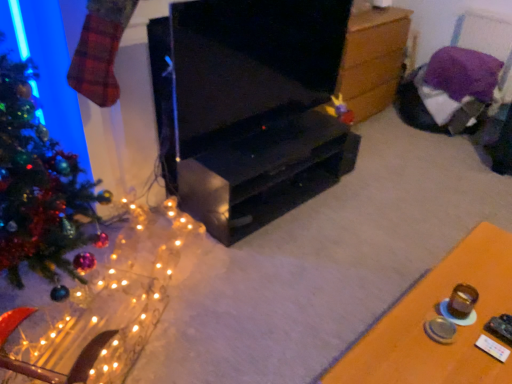
The height and width of the screenshot is (384, 512). I want to click on blank space above wooden table at lower right, placed as the second table when sorted from top to bottom (from a real-world perspective), so click(453, 314).